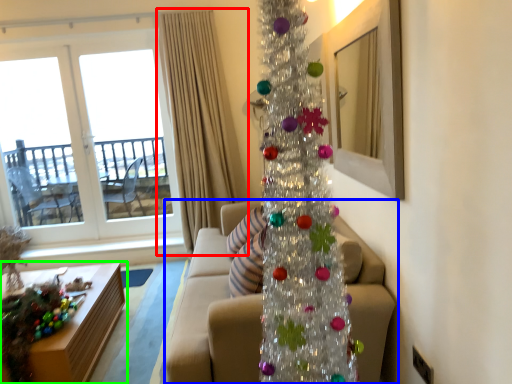
Question: Estimate the real-world distances between objects in this image. Which object is farther from curtain (highlighted by a red box), studio couch (highlighted by a blue box) or table (highlighted by a green box)?

Choices:
 (A) studio couch
 (B) table

Answer: (B)